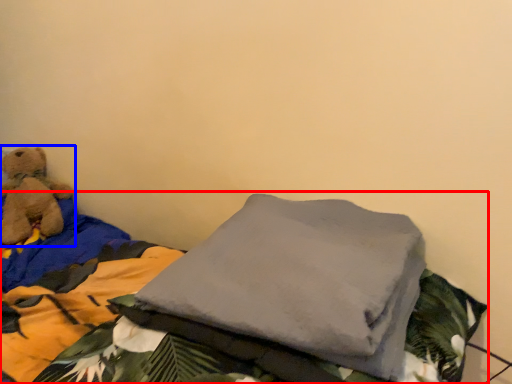
Question: Which object appears closest to the camera in this image, bed (highlighted by a red box) or teddy bear (highlighted by a blue box)?

Choices:
 (A) bed
 (B) teddy bear

Answer: (A)